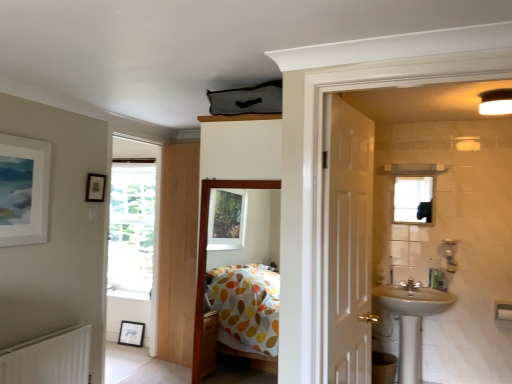
Question: Could you tell me if polka dot fabric bed at center is turned towards silver metallic tap at right?

Choices:
 (A) no
 (B) yes

Answer: (A)

Question: Is polka dot fabric bed at center not inside silver metallic tap at right?

Choices:
 (A) yes
 (B) no

Answer: (A)

Question: Can you confirm if polka dot fabric bed at center is taller than silver metallic tap at right?

Choices:
 (A) no
 (B) yes

Answer: (B)

Question: Is polka dot fabric bed at center touching silver metallic tap at right?

Choices:
 (A) no
 (B) yes

Answer: (A)

Question: From a real-world perspective, is polka dot fabric bed at center located beneath silver metallic tap at right?

Choices:
 (A) yes
 (B) no

Answer: (B)

Question: Considering the positions of silver metallic tap at right and clear glass mirror at upper right in the image, is silver metallic tap at right wider or thinner than clear glass mirror at upper right?

Choices:
 (A) thin
 (B) wide

Answer: (B)

Question: Considering the positions of silver metallic tap at right and clear glass mirror at upper right in the image, is silver metallic tap at right taller or shorter than clear glass mirror at upper right?

Choices:
 (A) short
 (B) tall

Answer: (A)

Question: From a real-world perspective, is silver metallic tap at right above or below clear glass mirror at upper right?

Choices:
 (A) below
 (B) above

Answer: (A)

Question: Considering the positions of point (412, 291) and point (394, 211), is point (412, 291) closer or farther from the camera than point (394, 211)?

Choices:
 (A) closer
 (B) farther

Answer: (A)

Question: Does point (103, 193) appear closer or farther from the camera than point (404, 177)?

Choices:
 (A) farther
 (B) closer

Answer: (B)

Question: From a real-world perspective, is matte black picture frame at upper left, the 2th picture frame viewed from the front, above or below clear glass mirror at upper right?

Choices:
 (A) below
 (B) above

Answer: (B)

Question: Visually, is matte black picture frame at upper left, which is the third picture frame in bottom-to-top order, positioned to the left or to the right of clear glass mirror at upper right?

Choices:
 (A) left
 (B) right

Answer: (A)

Question: Relative to clear glass mirror at upper right, is matte black picture frame at upper left, the 2th picture frame viewed from the front, in front or behind?

Choices:
 (A) behind
 (B) front

Answer: (B)

Question: Is point (200, 319) positioned closer to the camera than point (90, 183)?

Choices:
 (A) closer
 (B) farther

Answer: (A)

Question: From a real-world perspective, is polka dot fabric bed at center physically located above or below matte black picture frame at upper left, which is the third picture frame in bottom-to-top order?

Choices:
 (A) below
 (B) above

Answer: (A)